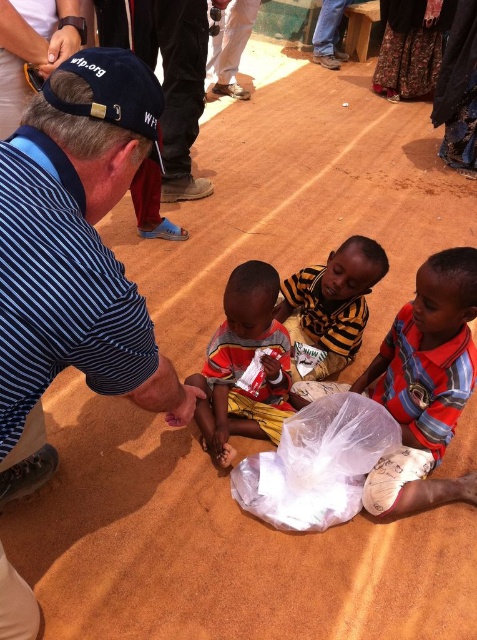
Can you confirm if blue fabric cap at upper left is smaller than pink matte hand at lower center?

Correct, blue fabric cap at upper left occupies less space than pink matte hand at lower center.

What do you see at coordinates (114, 90) in the screenshot? I see `blue fabric cap at upper left` at bounding box center [114, 90].

Does point (87, 49) come behind point (174, 401)?

No.

The height and width of the screenshot is (640, 477). Find the location of `blue fabric cap at upper left`. blue fabric cap at upper left is located at coordinates (114, 90).

Who is more distant from viewer, (269,360) or (317,314)?

The point (317,314) is more distant.

Does striped fabric shirt at center have a greater height compared to yellow/black striped shirt at center?

Yes, striped fabric shirt at center is taller than yellow/black striped shirt at center.

The image size is (477, 640). I want to click on striped fabric shirt at center, so click(245, 364).

Describe the element at coordinates (75, 241) in the screenshot. I see `blue striped shirt at center` at that location.

Does point (33, 198) lie in front of point (307, 282)?

Yes, it is.

This screenshot has width=477, height=640. Find the location of `blue striped shirt at center`. blue striped shirt at center is located at coordinates (75, 241).